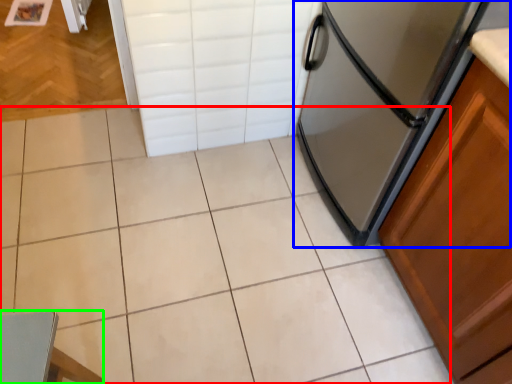
Question: Which is farther away from ceramic tile (highlighted by a red box)? refrigerator (highlighted by a blue box) or chair (highlighted by a green box)?

Choices:
 (A) refrigerator
 (B) chair

Answer: (B)